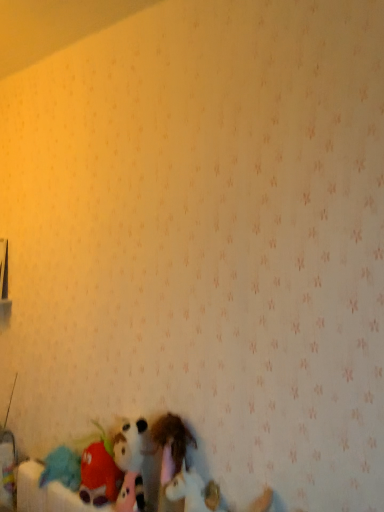
Question: Is fluffy plush toy at lower left, the 3th toy from the right, completely or partially outside of fuzzy fabric stuffed animal at lower center, the second toy viewed from the left?

Choices:
 (A) yes
 (B) no

Answer: (A)

Question: Can you confirm if fluffy plush toy at lower left, the 3th toy from the right, is shorter than fuzzy fabric stuffed animal at lower center, positioned as the 2th toy in right-to-left order?

Choices:
 (A) no
 (B) yes

Answer: (B)

Question: Does fluffy plush toy at lower left, which ranks as the first toy in left-to-right order, have a smaller size compared to fuzzy fabric stuffed animal at lower center, positioned as the 2th toy in right-to-left order?

Choices:
 (A) no
 (B) yes

Answer: (A)

Question: Can you confirm if fluffy plush toy at lower left, which ranks as the first toy in left-to-right order, is thinner than fuzzy fabric stuffed animal at lower center, positioned as the 2th toy in right-to-left order?

Choices:
 (A) no
 (B) yes

Answer: (A)

Question: Is fluffy plush toy at lower left, the 3th toy from the right, to the left of fuzzy fabric stuffed animal at lower center, positioned as the 2th toy in right-to-left order, from the viewer's perspective?

Choices:
 (A) no
 (B) yes

Answer: (B)

Question: Is fluffy plush toy at lower left, which ranks as the first toy in left-to-right order, oriented towards fuzzy fabric stuffed animal at lower center, positioned as the 2th toy in right-to-left order?

Choices:
 (A) yes
 (B) no

Answer: (B)

Question: Is white plush unicorn at lower center, which is counted as the first toy, starting from the right, outside fuzzy fabric stuffed animal at lower center, positioned as the 2th toy in right-to-left order?

Choices:
 (A) yes
 (B) no

Answer: (B)

Question: Is white plush unicorn at lower center, which is counted as the first toy, starting from the right, at the left side of fuzzy fabric stuffed animal at lower center, the second toy viewed from the left?

Choices:
 (A) yes
 (B) no

Answer: (B)

Question: Considering the relative sizes of white plush unicorn at lower center, the third toy from the left, and fuzzy fabric stuffed animal at lower center, positioned as the 2th toy in right-to-left order, in the image provided, is white plush unicorn at lower center, the third toy from the left, shorter than fuzzy fabric stuffed animal at lower center, positioned as the 2th toy in right-to-left order,?

Choices:
 (A) yes
 (B) no

Answer: (A)

Question: Could you tell me if white plush unicorn at lower center, the third toy from the left, is turned towards fuzzy fabric stuffed animal at lower center, positioned as the 2th toy in right-to-left order?

Choices:
 (A) yes
 (B) no

Answer: (B)

Question: Can you confirm if white plush unicorn at lower center, the third toy from the left, is wider than fuzzy fabric stuffed animal at lower center, positioned as the 2th toy in right-to-left order?

Choices:
 (A) no
 (B) yes

Answer: (A)

Question: Is white plush unicorn at lower center, the third toy from the left, bigger than fuzzy fabric stuffed animal at lower center, the second toy viewed from the left?

Choices:
 (A) no
 (B) yes

Answer: (A)

Question: Can you confirm if fluffy plush toy at lower left, the 3th toy from the right, is positioned to the left of white plush unicorn at lower center, which is counted as the first toy, starting from the right?

Choices:
 (A) yes
 (B) no

Answer: (A)